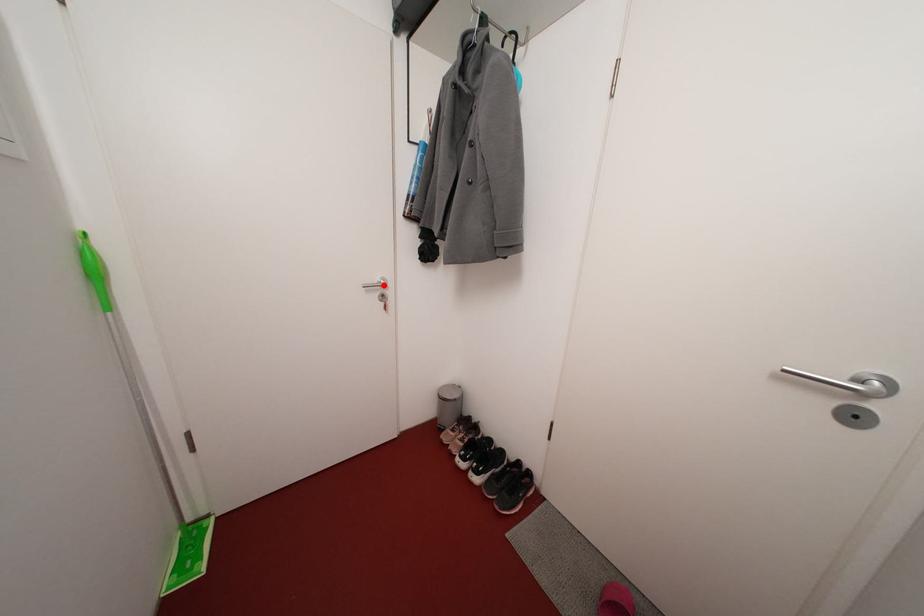
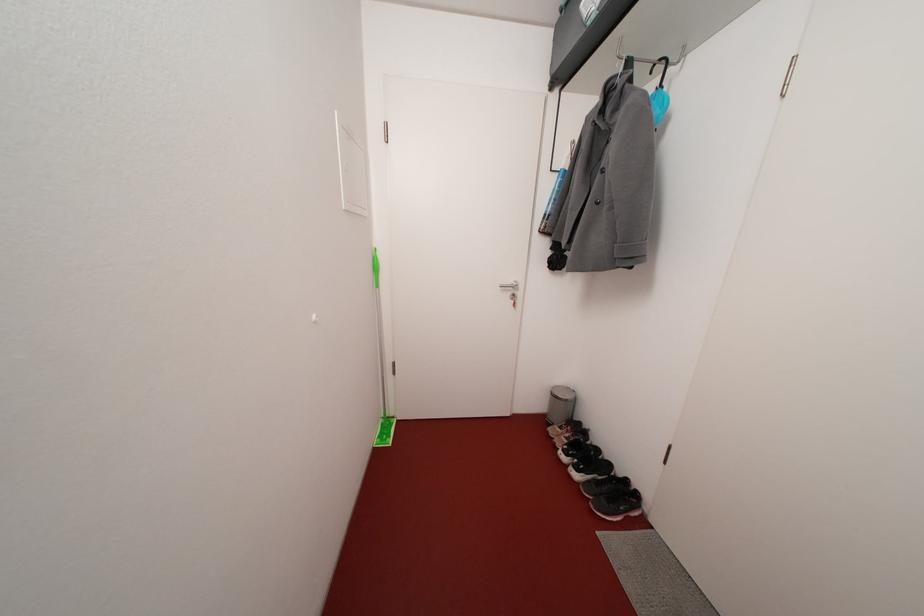
Where in the second image is the point corresponding to the highlighted location from the first image?

(517, 286)